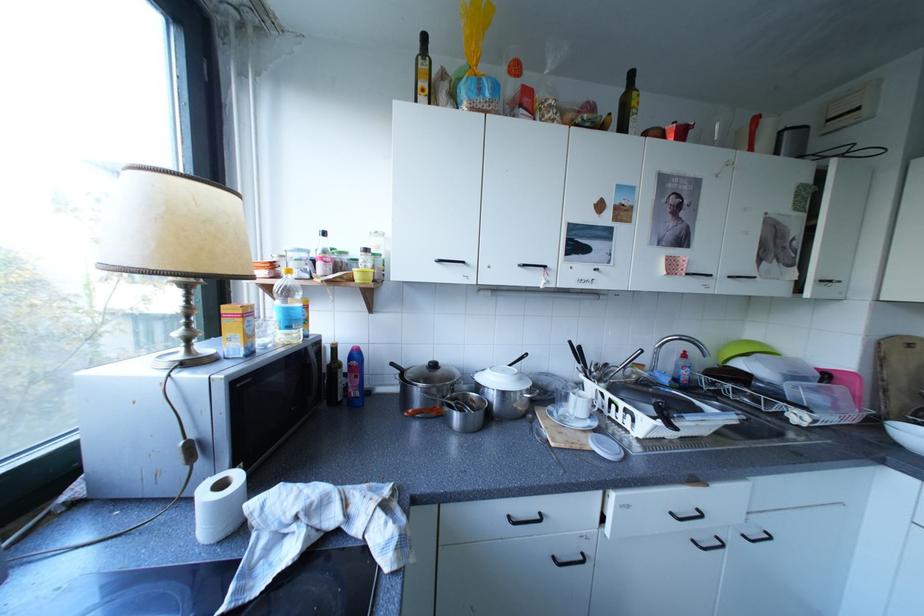
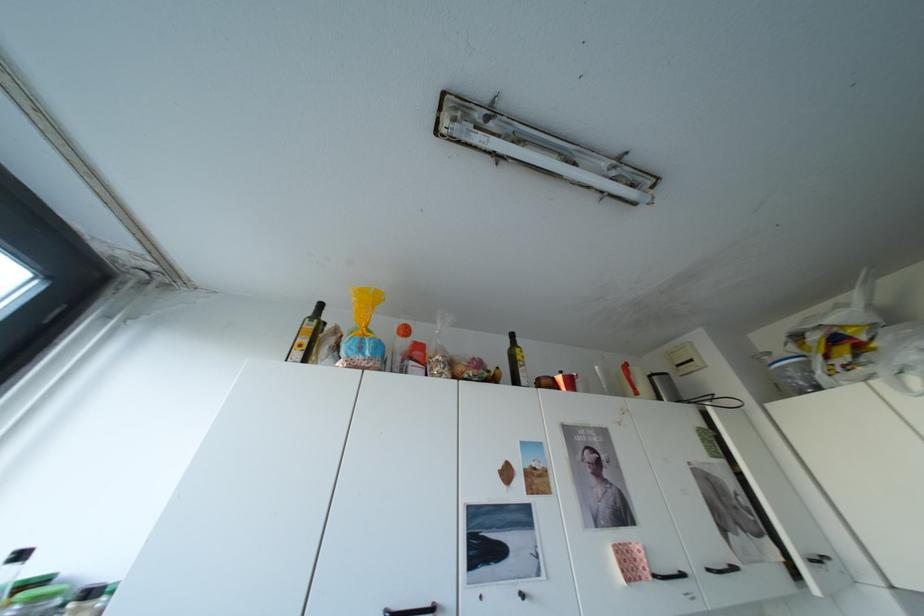
The point at (685, 267) is marked in the first image. Where is the corresponding point in the second image?

(642, 568)